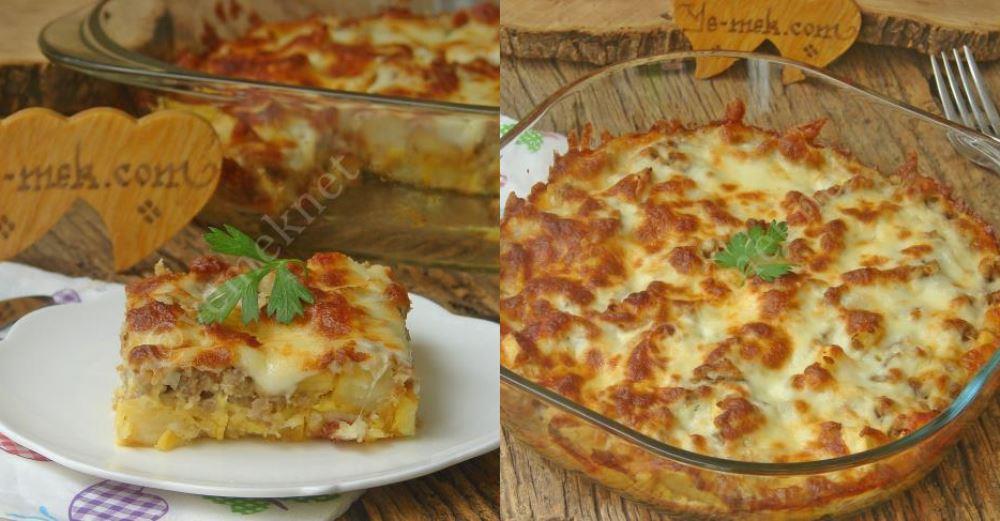
This screenshot has height=521, width=1000. Identify the location of transparent bowl. (286, 140).